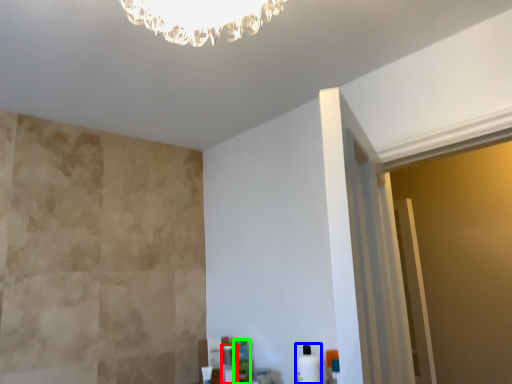
Question: Which is farther away from toiletry (highlighted by a red box)? toiletry (highlighted by a blue box) or toiletry (highlighted by a green box)?

Choices:
 (A) toiletry
 (B) toiletry

Answer: (A)